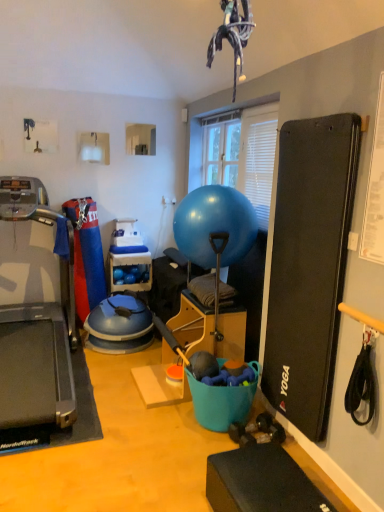
Question: Considering the positions of blue plastic shelf at center and glossy rubber ball at center in the image, is blue plastic shelf at center wider or thinner than glossy rubber ball at center?

Choices:
 (A) thin
 (B) wide

Answer: (A)

Question: From the image's perspective, is blue plastic shelf at center positioned above or below glossy rubber ball at center?

Choices:
 (A) above
 (B) below

Answer: (B)

Question: Which of these objects is positioned farthest from the glossy rubber ball at center?

Choices:
 (A) blue plastic shelf at center
 (B) black rubber treadmill at left

Answer: (A)

Question: Which object is positioned farthest from the glossy rubber ball at center?

Choices:
 (A) blue plastic shelf at center
 (B) black rubber treadmill at left

Answer: (A)